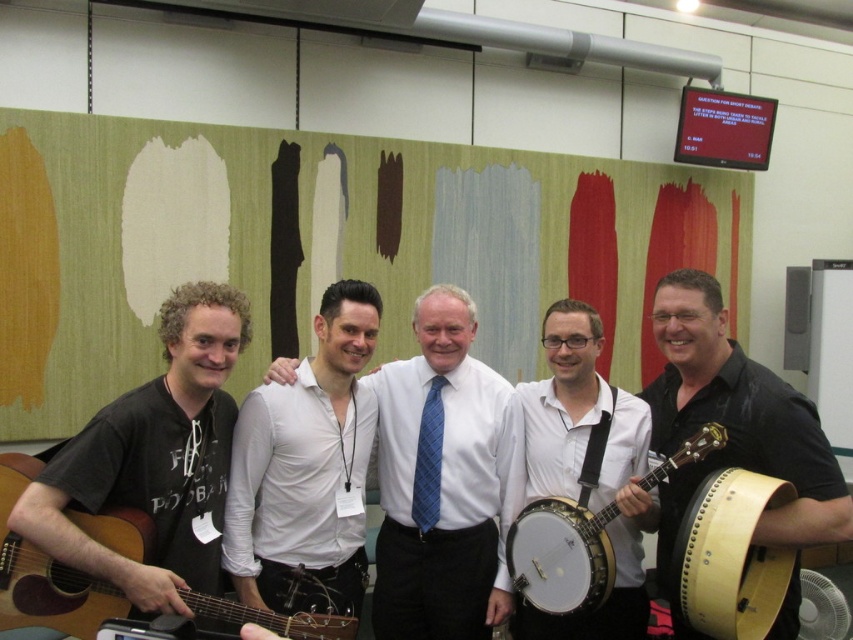
You are a photographer trying to capture a clear shot of the white shirt at center and the black leather banjo at center. Based on their positions, which one is closer to the camera?

The white shirt at center is below the black leather banjo at center, so the banjo is closer to the camera.

You are a photographer setting up for a group photo. You need to ensure that the wooden drum at right and the white wooden banjo at center are both in focus. Based on their positions, which object should you focus on first to ensure both are sharp?

The wooden drum at right is positioned under the white wooden banjo at center. To ensure both are in focus, you should focus on the white wooden banjo at center first, as it is closer to the camera, and the drum behind it will naturally fall into the depth of field.

You are organizing a music performance and need to place the wooden drum at right and the white wooden banjo at center on a stage. Given their sizes, which instrument should be placed closer to the front to ensure both are visible to the audience?

The wooden drum at right should be placed closer to the front because it occupies less space than the white wooden banjo at center, allowing both instruments to be visible to the audience.